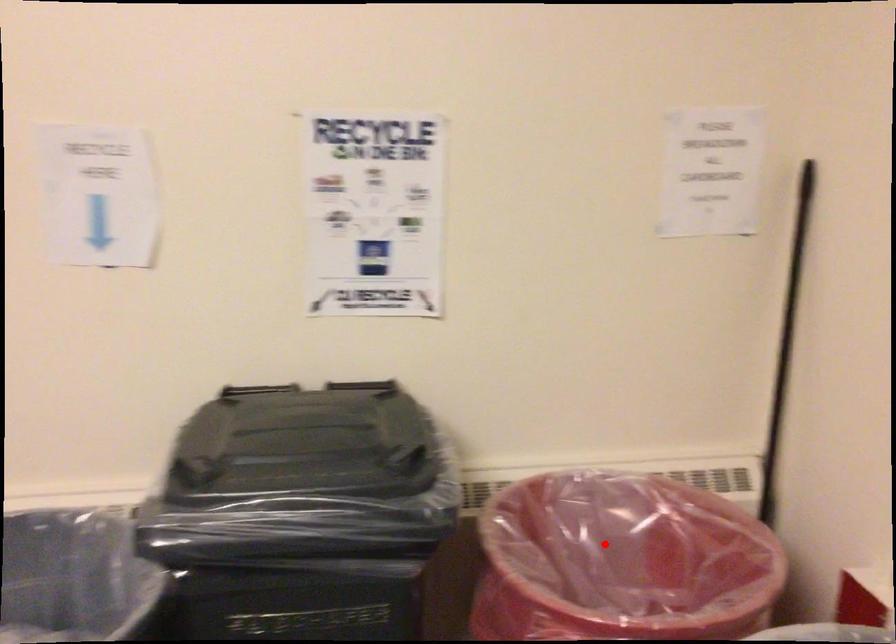
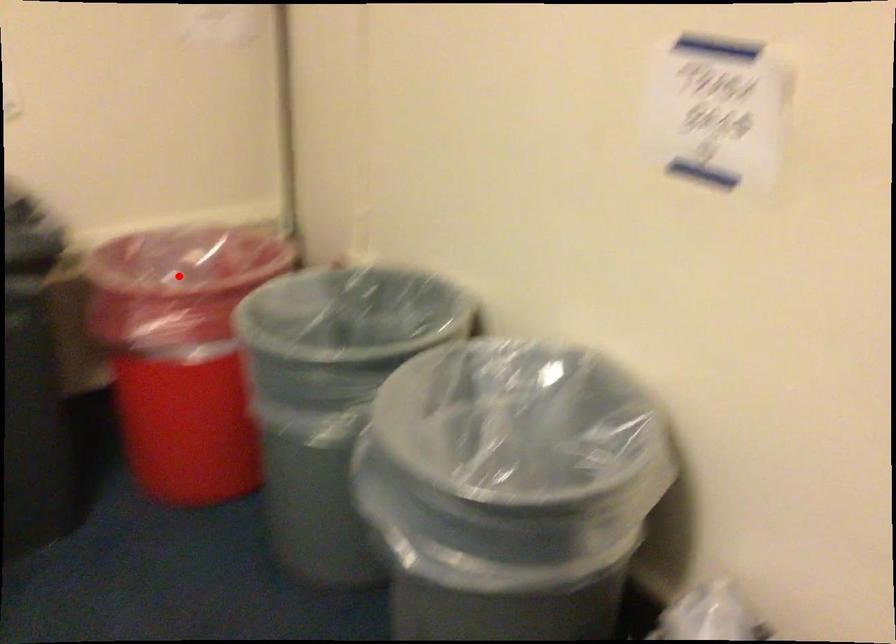
I am providing you with two images of the same scene from different viewpoints. A red point is marked on the first image and another point is marked on the second image. Are the points marked in image1 and image2 representing the same 3D position?

Yes